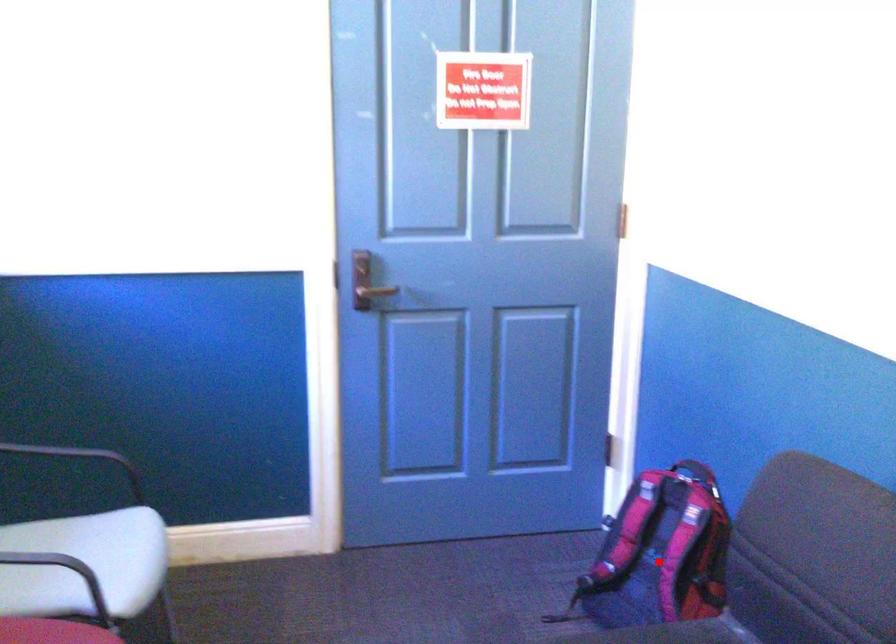
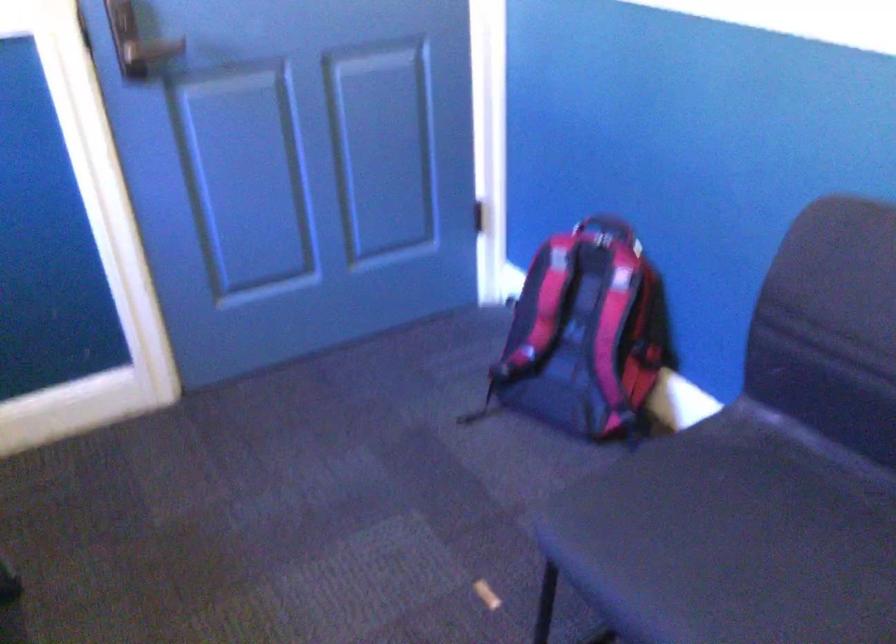
Find the pixel in the second image that matches the highlighted location in the first image.

(584, 335)